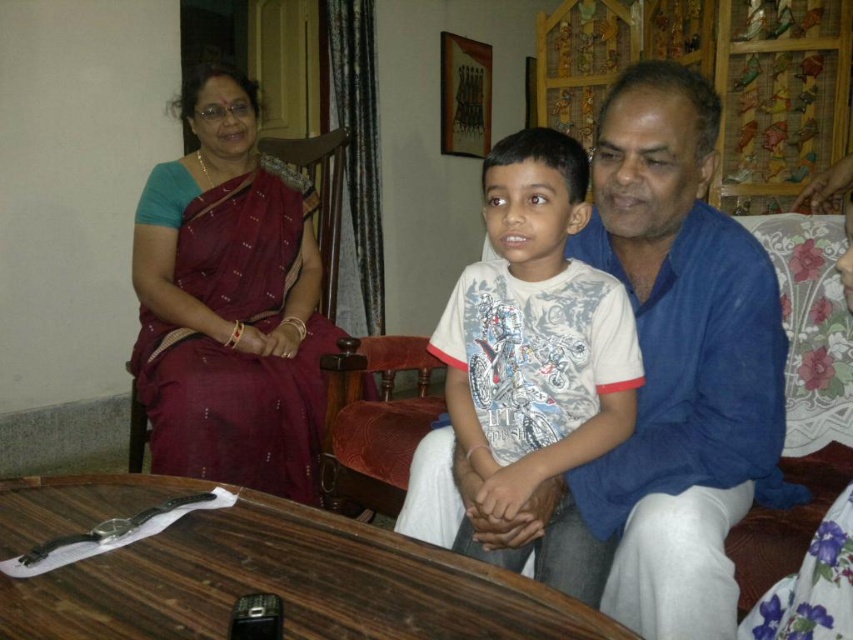
You are standing in the living room and want to place a small vase between the two points labeled point (729, 602) and point (241, 422). Which point should the vase be closer to in order to be nearer to the viewer?

The vase should be placed closer to point (729, 602) because it is closer to the viewer than point (241, 422).